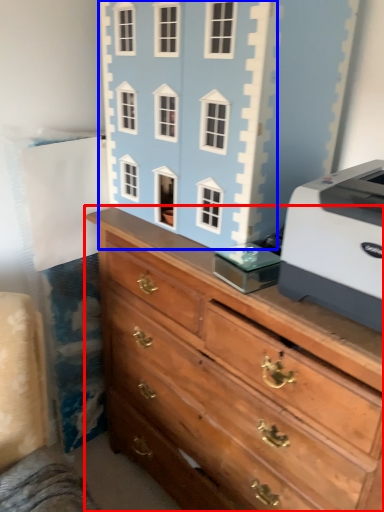
Question: Which of the following is the closest to the observer, chest of drawers (highlighted by a red box) or toy (highlighted by a blue box)?

Choices:
 (A) chest of drawers
 (B) toy

Answer: (A)